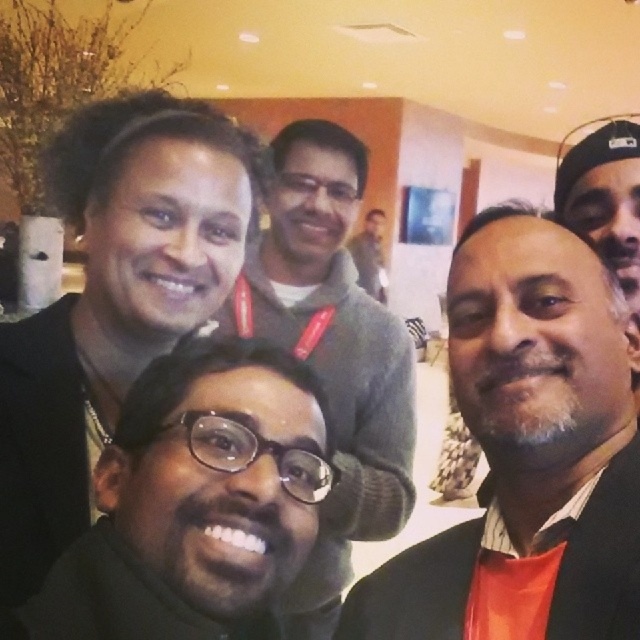
Looking at this image, you are standing in the room where the selfie was taken and want to place a 50 cm wide decorative shelf between the two people wearing the matte black sweater at center. Is there enough space?

The two people wearing the matte black sweater at center are 53.54 centimeters apart, so yes, the 50 cm wide decorative shelf can fit between them since the space is wider than the shelf.

You are trying to take a photo of the black matte face at left and the black matte glasses at center. Which object should you focus on if you want to capture the wider one?

The black matte face at left might be wider than black matte glasses at center, so you should focus on the black matte face at left to capture the wider one.